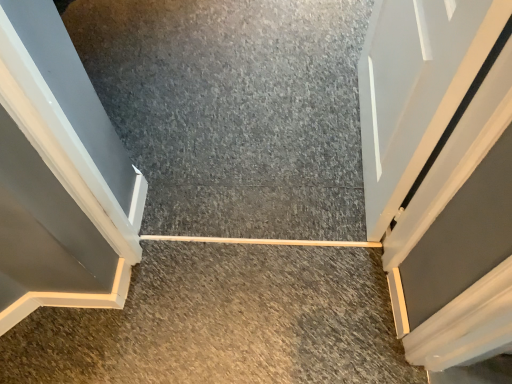
Question: In terms of size, does smooth concrete at center, acting as the 1th concrete starting from the bottom, appear bigger or smaller than smooth concrete at center, acting as the first concrete starting from the back?

Choices:
 (A) big
 (B) small

Answer: (B)

Question: Considering their positions, is smooth concrete at center, which is the 2th concrete from top to bottom, located in front of or behind smooth concrete at center, acting as the first concrete starting from the back?

Choices:
 (A) front
 (B) behind

Answer: (A)

Question: Which object is the farthest from the white glossy door at upper right?

Choices:
 (A) smooth concrete at center, the second concrete positioned from the bottom
 (B) smooth concrete at center, the 1th concrete positioned from the front

Answer: (B)

Question: Estimate the real-world distances between objects in this image. Which object is closer to the white glossy door at upper right?

Choices:
 (A) smooth concrete at center, the second concrete positioned from the bottom
 (B) smooth concrete at center, which is the 2th concrete from top to bottom

Answer: (A)